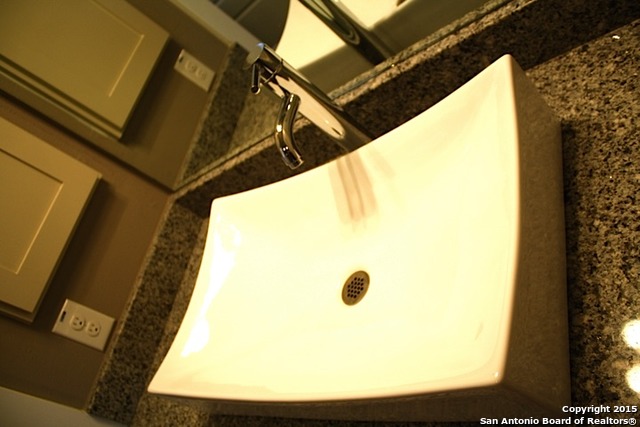
This screenshot has width=640, height=427. In order to click on outlet in this screenshot , I will do `click(70, 319)`, `click(102, 331)`.